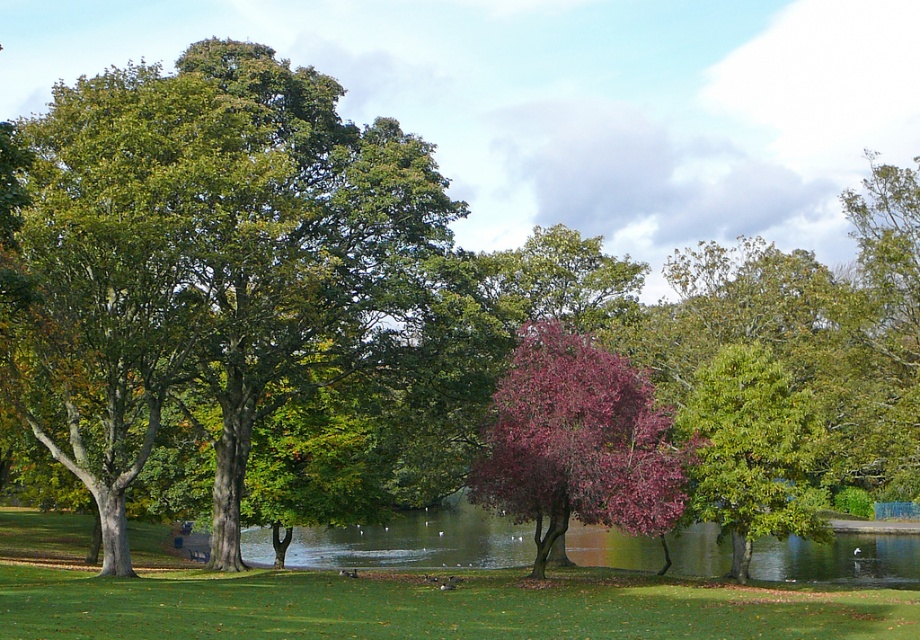
You are standing in the park and want to walk from the central tree to the point marked as point (690, 492). Which direction should you move relative to the point marked as point (606, 488)?

You should move away from the point marked as point (606, 488) because point (690, 492) is further from the viewer compared to point (606, 488).

In the scene shown: You are a photographer planning to capture the purple glossy tree at center and the green glossy tree at right in a single frame. Based on their positions, which tree should you focus on first to ensure both are in the shot?

The purple glossy tree at center is positioned on the left side of the green glossy tree at right, so you should focus on the purple glossy tree at center first to frame both trees properly.

You are a photographer planning to capture the green grassy lake at center and the green glossy tree at right in a single frame. Based on their positions, which object will appear larger in the photo?

The green grassy lake at center will appear larger in the photo because it is taller than the green glossy tree at right.